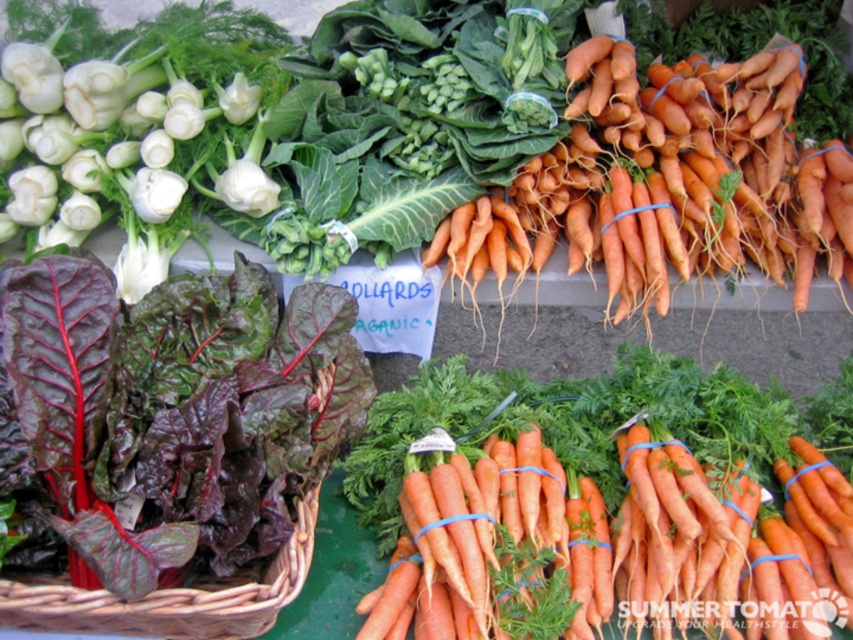
Question: Estimate the real-world distances between objects in this image. Which object is closer to the orange matte carrots at upper right?

Choices:
 (A) orange smooth carrots at center
 (B) dark red leafy greens at left
 (C) brown woven basket at lower left

Answer: (A)

Question: Which point is closer to the camera taking this photo?

Choices:
 (A) (602, 566)
 (B) (839, 225)
 (C) (9, 310)

Answer: (C)

Question: Is orange matte carrots at upper right in front of orange smooth carrots at center?

Choices:
 (A) yes
 (B) no

Answer: (B)

Question: From the image, what is the correct spatial relationship of orange smooth carrots at center in relation to brown woven basket at lower left?

Choices:
 (A) below
 (B) above

Answer: (B)

Question: Does dark red leafy greens at left appear on the left side of orange matte carrots at upper right?

Choices:
 (A) no
 (B) yes

Answer: (B)

Question: Which object is closer to the camera taking this photo?

Choices:
 (A) orange smooth carrots at center
 (B) orange matte carrots at upper right
 (C) dark red leafy greens at left
 (D) brown woven basket at lower left

Answer: (C)